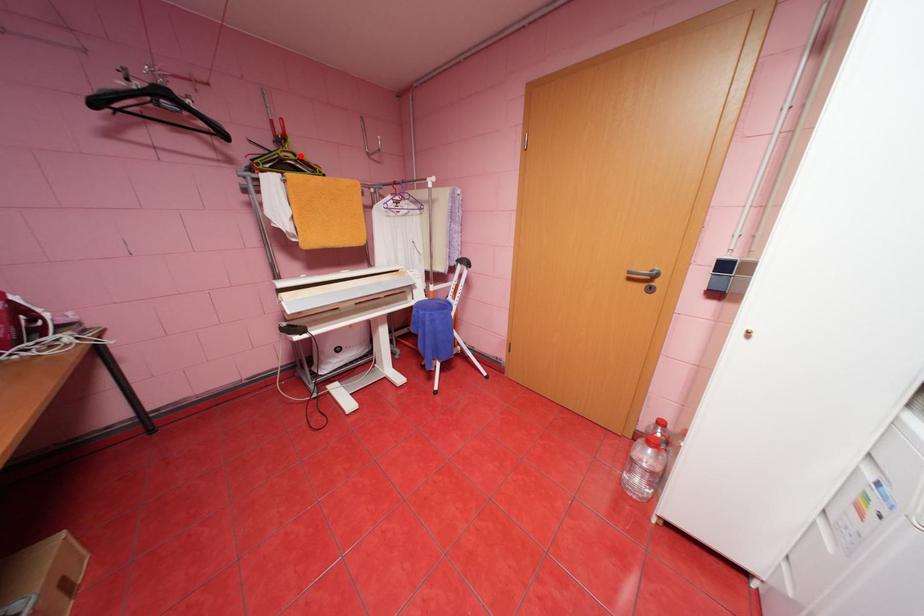
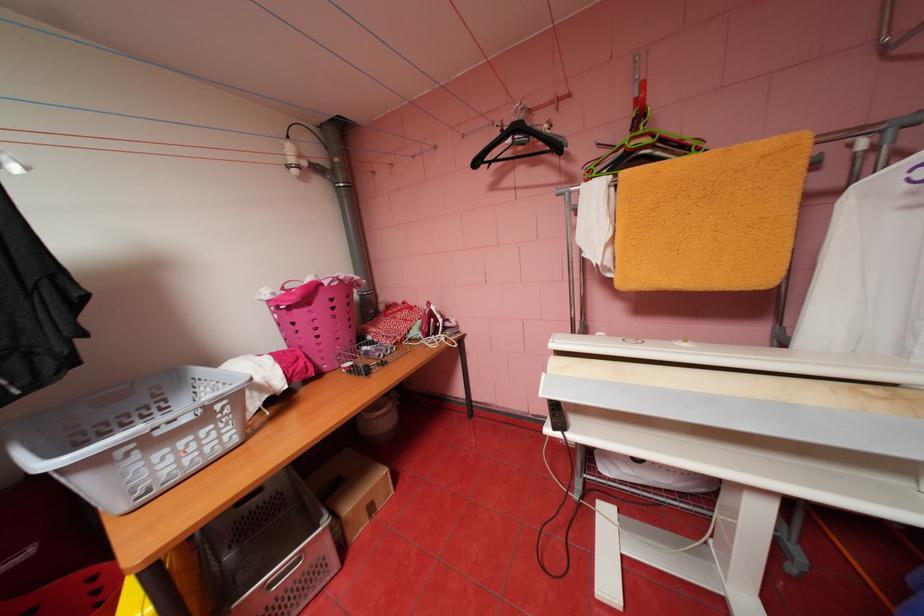
Where in the second image is the point corresponding to the highlighted location from the first image?

(655, 140)